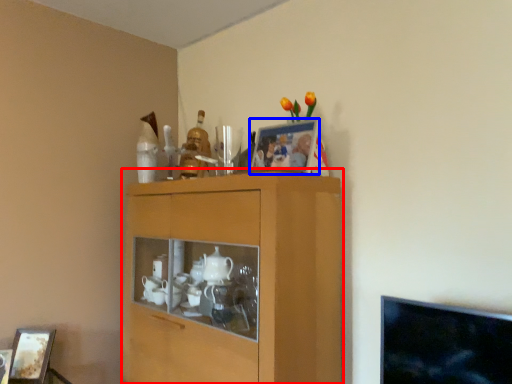
Question: Which of the following is the closest to the observer, cabinetry (highlighted by a red box) or picture frame (highlighted by a blue box)?

Choices:
 (A) cabinetry
 (B) picture frame

Answer: (A)